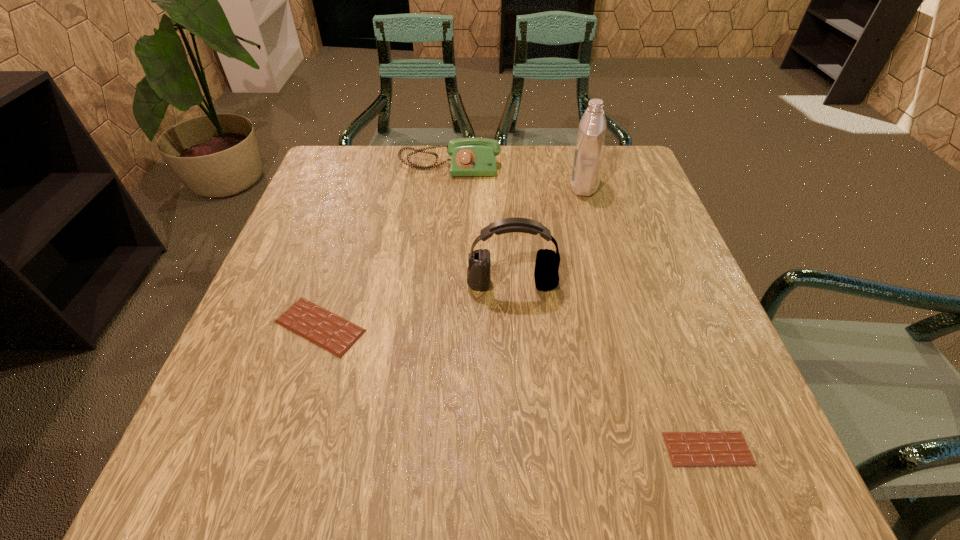
I want to click on the tallest object, so click(x=589, y=148).

This screenshot has width=960, height=540. What are the coordinates of `headset` in the screenshot? It's located at (546, 275).

Find the location of a particular element. Image resolution: width=960 pixels, height=540 pixels. the fourth shortest object is located at coordinates (546, 275).

Locate an element on the screen. This screenshot has width=960, height=540. telephone is located at coordinates (469, 156).

This screenshot has height=540, width=960. I want to click on the fourth farthest object, so click(x=327, y=330).

This screenshot has height=540, width=960. Identify the location of the second shortest object. (327, 330).

Locate an element on the screen. The width and height of the screenshot is (960, 540). the nearest object is located at coordinates (717, 448).

The height and width of the screenshot is (540, 960). I want to click on the shorter chocolate bar, so click(x=717, y=448).

Locate an element on the screen. free space located 0.080m on the back of the tallest object is located at coordinates (576, 158).

The image size is (960, 540). I want to click on free space located 0.360m on the headband of the third nearest object, so click(526, 478).